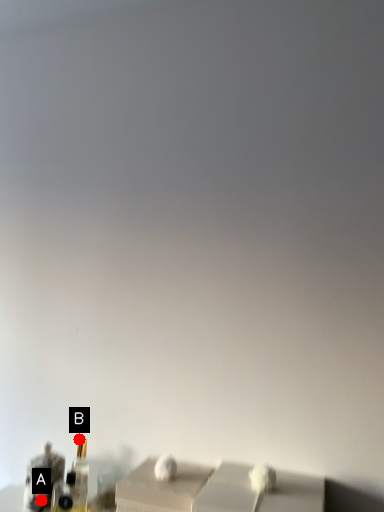
Question: Two points are circled on the image, labeled by A and B beside each circle. Which point is closer to the camera taking this photo?

Choices:
 (A) A is closer
 (B) B is closer

Answer: (A)